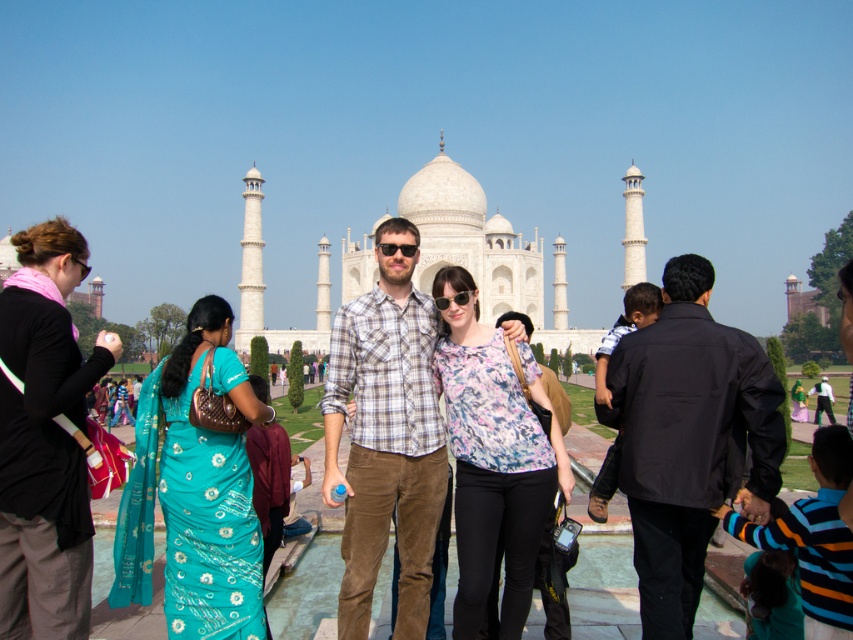
Who is lower down, black fabric jacket at left or teal silk saree at left?

Positioned lower is teal silk saree at left.

Is point (9, 550) farther from camera compared to point (158, 490)?

No.

This screenshot has height=640, width=853. In order to click on black fabric jacket at left in this screenshot , I will do `click(45, 440)`.

Locate an element on the screen. Image resolution: width=853 pixels, height=640 pixels. black fabric jacket at left is located at coordinates (45, 440).

Can you confirm if plaid cotton shirt at center is positioned to the right of black fabric jacket at left?

Yes, plaid cotton shirt at center is to the right of black fabric jacket at left.

Does plaid cotton shirt at center have a lesser height compared to black fabric jacket at left?

No, plaid cotton shirt at center is not shorter than black fabric jacket at left.

Which is behind, point (392, 509) or point (82, 605)?

Point (392, 509)

Where is `plaid cotton shirt at center`? The height and width of the screenshot is (640, 853). plaid cotton shirt at center is located at coordinates (x=386, y=435).

Between point (190, 396) and point (474, 560), which one is positioned behind?

The point (190, 396) is more distant.

Can you confirm if teal silk saree at left is positioned to the right of floral fabric blouse at center?

In fact, teal silk saree at left is to the left of floral fabric blouse at center.

Is point (177, 436) farther from camera compared to point (531, 484)?

No, (177, 436) is in front of (531, 484).

Locate an element on the screen. This screenshot has height=640, width=853. teal silk saree at left is located at coordinates (194, 493).